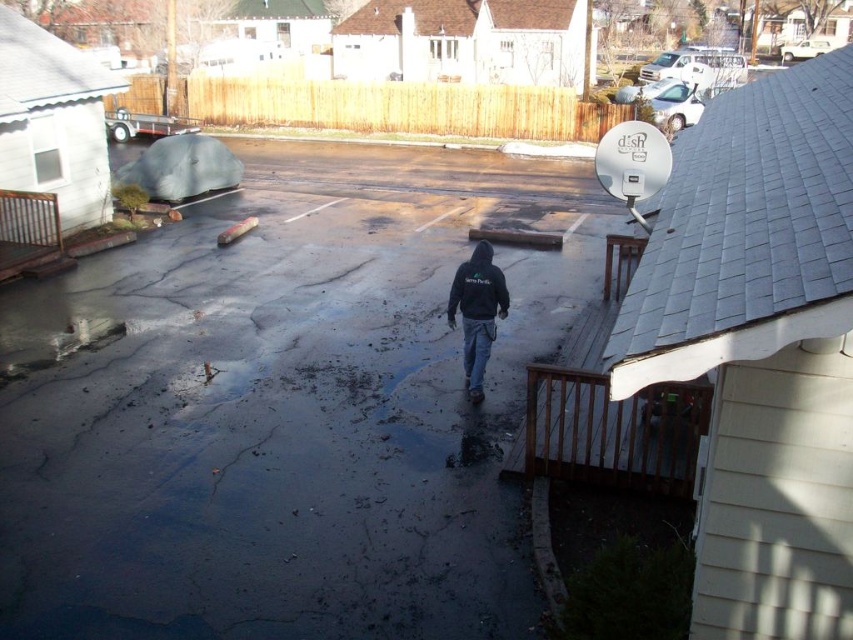
Question: Which object is farther from the camera taking this photo?

Choices:
 (A) black fleece sweatshirt at center
 (B) black hoodie at center
 (C) brown wooden porch at left

Answer: (C)

Question: Can you confirm if wooden at lower right is positioned to the right of black hoodie at center?

Choices:
 (A) no
 (B) yes

Answer: (B)

Question: Does black hoodie at center come behind black fleece sweatshirt at center?

Choices:
 (A) yes
 (B) no

Answer: (A)

Question: Which of the following is the farthest from the observer?

Choices:
 (A) brown wooden porch at left
 (B) black fleece sweatshirt at center
 (C) wooden at lower right
 (D) black hoodie at center

Answer: (A)

Question: Which point appears farthest from the camera in this image?

Choices:
 (A) (602, 324)
 (B) (477, 269)
 (C) (495, 285)

Answer: (A)

Question: Is black hoodie at center thinner than black fleece sweatshirt at center?

Choices:
 (A) no
 (B) yes

Answer: (B)